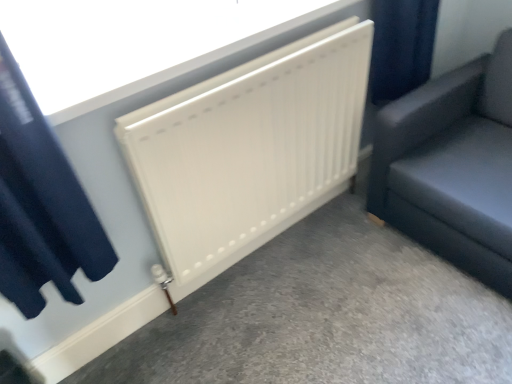
Question: Is dark blue velvet curtain at upper left in front of or behind matte black sofa at right in the image?

Choices:
 (A) behind
 (B) front

Answer: (B)

Question: Does point (31, 258) appear closer or farther from the camera than point (428, 218)?

Choices:
 (A) farther
 (B) closer

Answer: (B)

Question: Which object is the farthest from the white matte radiator at center?

Choices:
 (A) matte black sofa at right
 (B) white matte radiator at center
 (C) white matte radiator at center
 (D) dark blue velvet curtain at upper left

Answer: (C)

Question: Which object is the closest to the white matte radiator at center?

Choices:
 (A) white matte radiator at center
 (B) matte black sofa at right
 (C) dark blue velvet curtain at upper left
 (D) white matte radiator at center

Answer: (A)